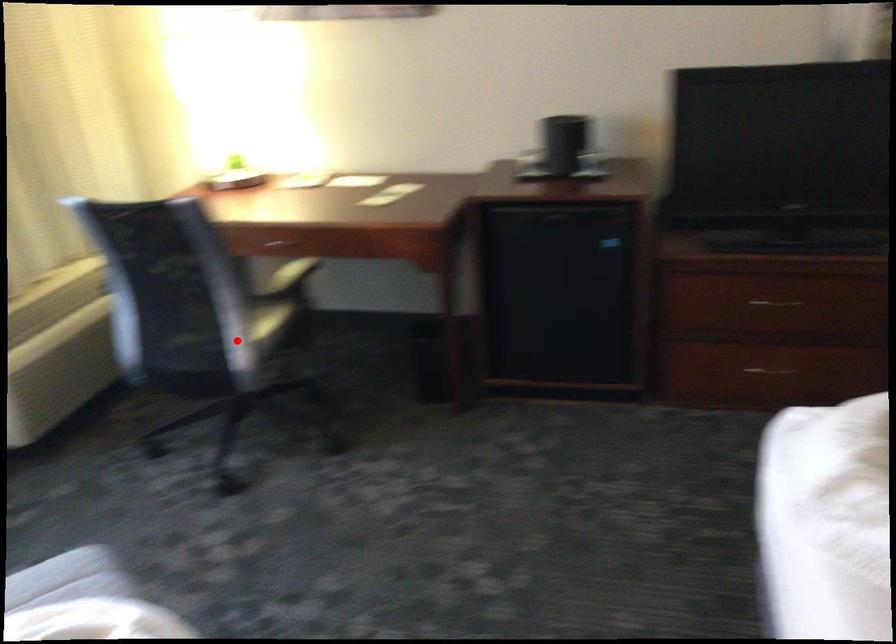
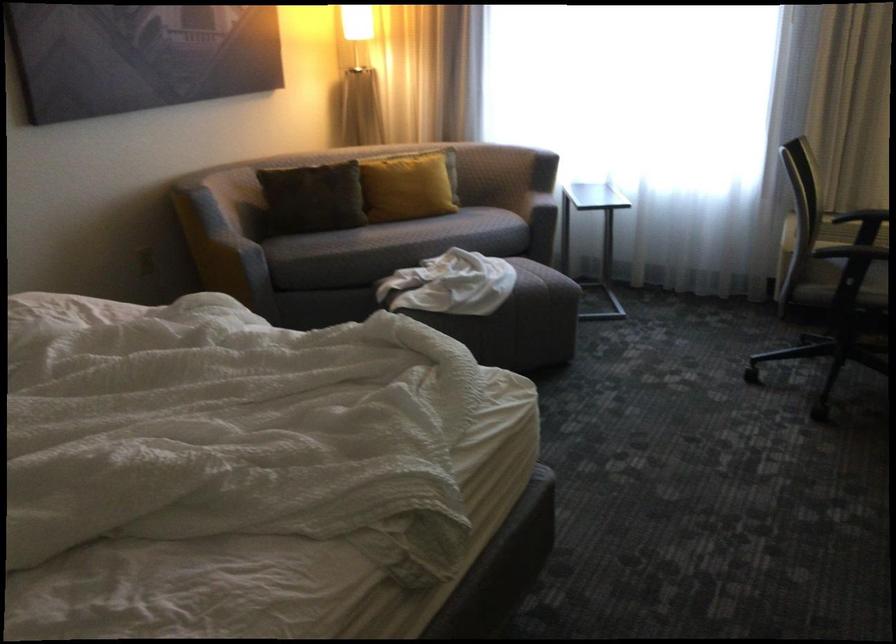
Question: I am providing you with two images of the same scene from different viewpoints. Image1 has a red point marked. In image2, the corresponding 3D location appears at what relative position? Reply with the corresponding letter.

Choices:
 (A) Closer
 (B) Farther

Answer: (B)